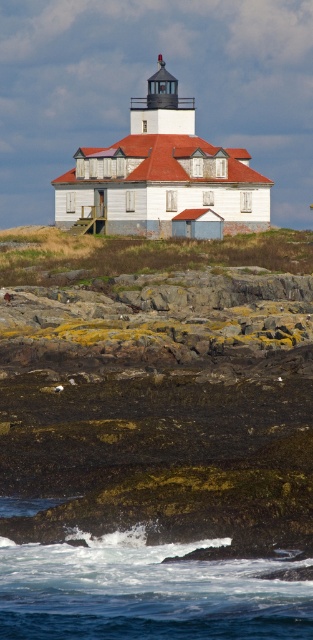
Based on the photo, you are standing on the rocky coast looking at the white wooden lighthouse at center and the white frothy water at lower center. Which object is closer to your viewpoint?

The white frothy water at lower center is closer to your viewpoint since it is positioned below the white wooden lighthouse at center.

You are standing at the base of the lighthouse and want to reach the top. There are two points marked on the lighthouse wall, one at point coordinate (236, 620) and the other at point coordinate (106, 208). Which point is higher up the lighthouse wall?

Point (106, 208) is higher up the lighthouse wall than point (236, 620) because in the image, point (106, 208) is further away from the viewer compared to point (236, 620), which means it is positioned higher on the lighthouse structure.